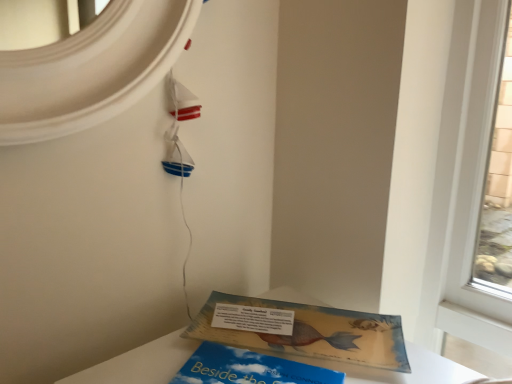
Locate an element on the screen. blank space situated above matte yellow book at lower center, the second book viewed from the front (from a real-world perspective) is located at coordinates (272, 309).